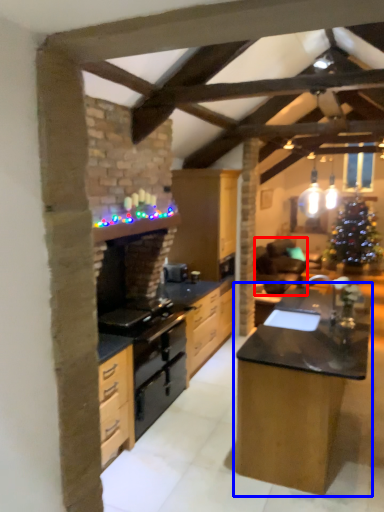
Question: Which object appears closest to the camera in this image, armchair (highlighted by a red box) or table (highlighted by a blue box)?

Choices:
 (A) armchair
 (B) table

Answer: (B)